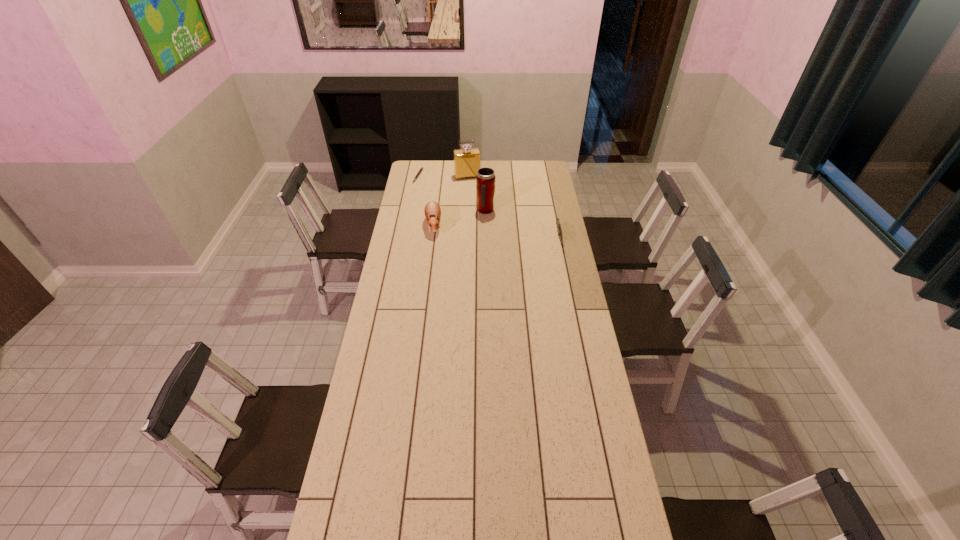
Find the location of a particular element. hamster is located at coordinates (432, 210).

This screenshot has height=540, width=960. I want to click on the third shortest object, so click(x=432, y=210).

The height and width of the screenshot is (540, 960). Find the location of `the rightmost object`. the rightmost object is located at coordinates (558, 224).

I want to click on the second shortest object, so click(558, 224).

Image resolution: width=960 pixels, height=540 pixels. What are the coordinates of `perfume` in the screenshot? It's located at (467, 161).

Find the location of a particular element. The height and width of the screenshot is (540, 960). the shortest object is located at coordinates (421, 168).

This screenshot has height=540, width=960. What are the coordinates of `the leftmost object` in the screenshot? It's located at (421, 168).

Where is `thermos bottle`? The height and width of the screenshot is (540, 960). thermos bottle is located at coordinates (485, 179).

At what (x,y) coordinates should I click in order to perform the action: click on vacant space positioned 0.220m at the face of the hamster. Please return your answer as a coordinate pair (x, y). This screenshot has width=960, height=540. Looking at the image, I should click on (428, 267).

Where is `vacant space situated 0.310m aimed along the barrel of the gun`? The image size is (960, 540). vacant space situated 0.310m aimed along the barrel of the gun is located at coordinates (571, 296).